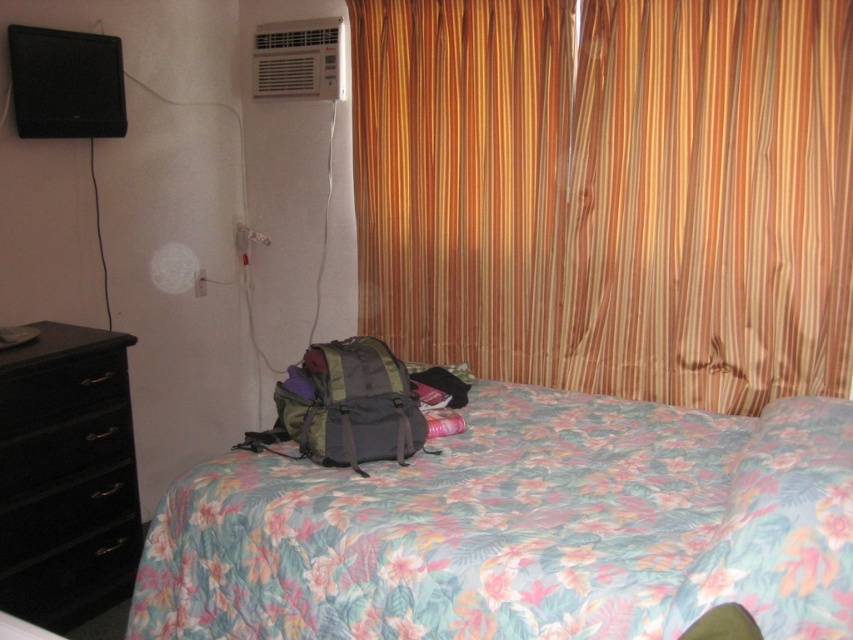
You are a delivery person trying to place a large package on the floor. The package is 1.2 meters tall. You see the floral fabric bed at center and the black glossy drawer at left. Can the package be placed between them without hitting the ceiling?

The floral fabric bed at center is taller than the black glossy drawer at left. Since the package is 1.2 meters tall, it might not fit if the bed is taller than that. However, the description only states the bed is taller than the drawer, but does not provide specific heights. Therefore, we cannot determine if the package will fit without additional information.

You are standing at the entrance of the bedroom and want to place a new lamp on the floral fabric bed at center. Based on its current position, where exactly should you aim to place the lamp?

The floral fabric bed at center is located at point (519,529), so you should aim to place the lamp at those coordinates to ensure it lands on the bed.